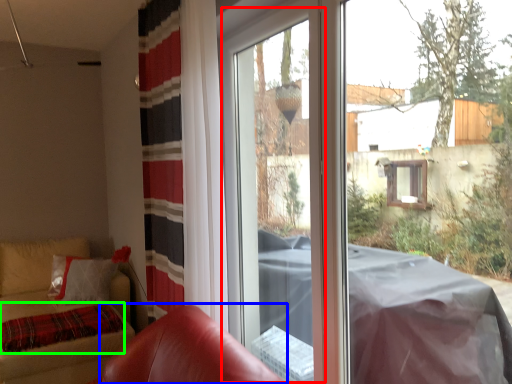
Question: Estimate the real-world distances between objects in this image. Which object is closer to screen door (highlighted by a red box), armchair (highlighted by a blue box) or blanket (highlighted by a green box)?

Choices:
 (A) armchair
 (B) blanket

Answer: (A)